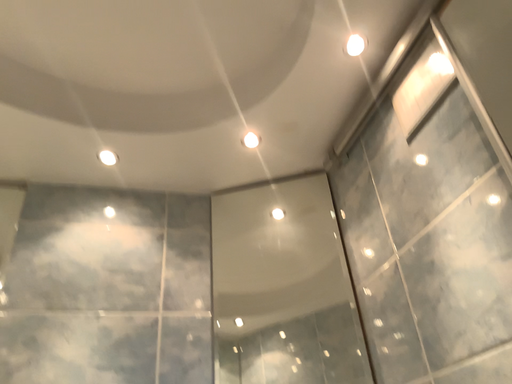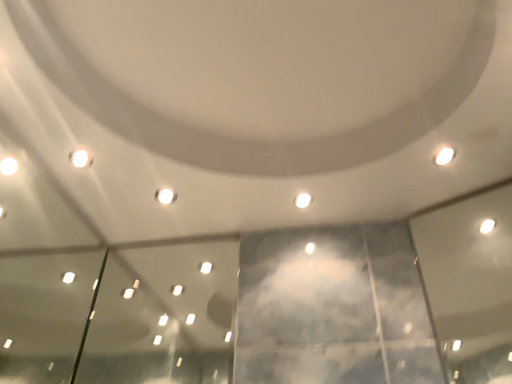
Question: How did the camera likely rotate when shooting the video?

Choices:
 (A) rotated right
 (B) rotated left

Answer: (B)